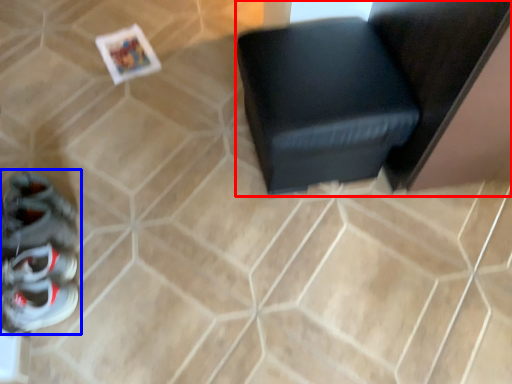
Question: Among these objects, which one is farthest to the camera, furniture (highlighted by a red box) or footwear (highlighted by a blue box)?

Choices:
 (A) furniture
 (B) footwear

Answer: (A)